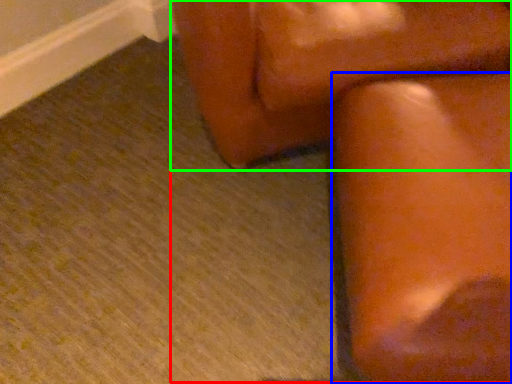
Question: Based on their relative distances, which object is farther from rocking chair (highlighted by a red box)? Choose from furniture (highlighted by a blue box) and furniture (highlighted by a green box).

Choices:
 (A) furniture
 (B) furniture

Answer: (B)